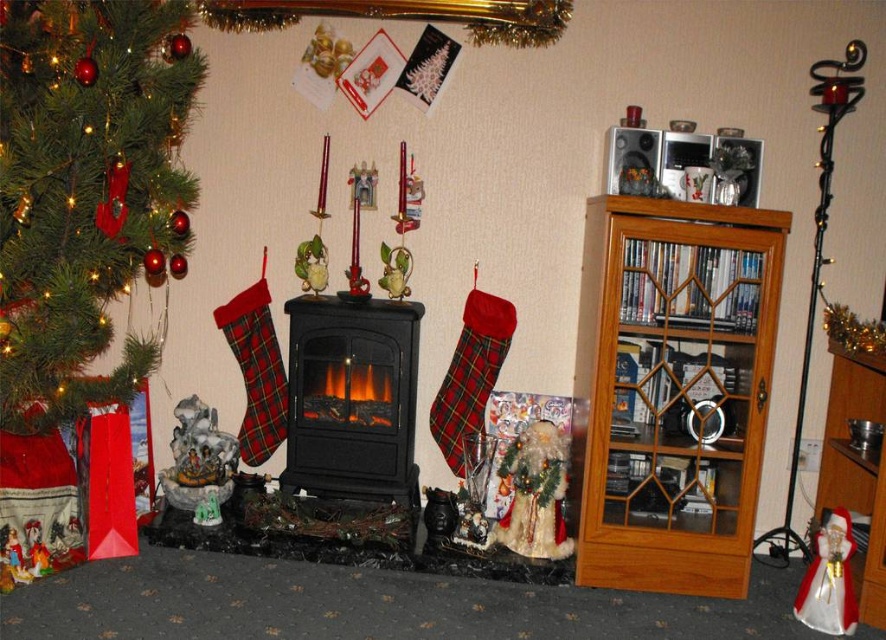
Is the position of green matte christmas tree at left more distant than that of wooden bookshelf at right?

That is False.

Can you confirm if green matte christmas tree at left is smaller than wooden bookshelf at right?

No, green matte christmas tree at left is not smaller than wooden bookshelf at right.

This screenshot has width=886, height=640. Describe the element at coordinates (86, 192) in the screenshot. I see `green matte christmas tree at left` at that location.

Image resolution: width=886 pixels, height=640 pixels. I want to click on green matte christmas tree at left, so 86,192.

Is green matte christmas tree at left thinner than black matte fireplace at center?

No, green matte christmas tree at left is not thinner than black matte fireplace at center.

You are a GUI agent. You are given a task and a screenshot of the screen. Output one action in this format:
    pyautogui.click(x=<x>, y=<y>)
    Task: Click on the green matte christmas tree at left
    The image size is (886, 640).
    Given the screenshot: What is the action you would take?
    pyautogui.click(x=86, y=192)

Locate an element on the screen. Image resolution: width=886 pixels, height=640 pixels. green matte christmas tree at left is located at coordinates pyautogui.click(x=86, y=192).

In order to click on green matte christmas tree at left in this screenshot , I will do `click(86, 192)`.

Is light brown wooden bookshelf at right positioned behind wooden bookshelf at right?

Yes, it is.

Which is in front, point (581, 476) or point (864, 602)?

Point (864, 602) is more forward.

The image size is (886, 640). I want to click on light brown wooden bookshelf at right, so click(672, 388).